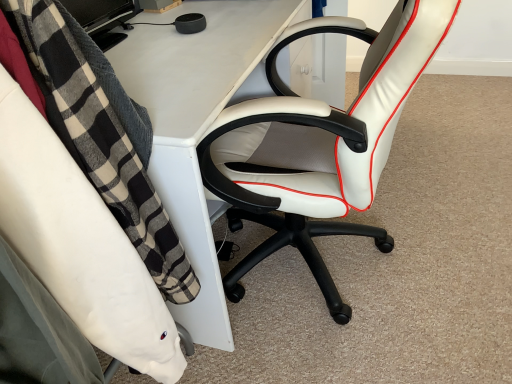
Describe the element at coordinates (79, 244) in the screenshot. The height and width of the screenshot is (384, 512). I see `white leather office chair at right, the first chair positioned from the left` at that location.

You are a GUI agent. You are given a task and a screenshot of the screen. Output one action in this format:
    pyautogui.click(x=<x>, y=<y>)
    Task: Click on the white leather office chair at right, the first chair positioned from the left
    This screenshot has height=384, width=512.
    Given the screenshot: What is the action you would take?
    pyautogui.click(x=79, y=244)

In the scene shown: Does white leather office chair at right, placed as the second chair when sorted from right to left, turn towards white leather office chair at center, which is the second chair in left-to-right order?

No, white leather office chair at right, placed as the second chair when sorted from right to left, is not turned towards white leather office chair at center, which is the second chair in left-to-right order.

Is white leather office chair at right, the first chair positioned from the left, far from white leather office chair at center, which is the 1th chair in right-to-left order?

That's not correct — white leather office chair at right, the first chair positioned from the left, is a little close to white leather office chair at center, which is the 1th chair in right-to-left order.

Considering the positions of objects white leather office chair at right, the first chair positioned from the left, and white leather office chair at center, which is the 1th chair in right-to-left order, in the image provided, who is more to the left, white leather office chair at right, the first chair positioned from the left, or white leather office chair at center, which is the 1th chair in right-to-left order,?

white leather office chair at right, the first chair positioned from the left.

In terms of size, does white leather office chair at right, placed as the second chair when sorted from right to left, appear bigger or smaller than white leather office chair at center, which is the second chair in left-to-right order?

In the image, white leather office chair at right, placed as the second chair when sorted from right to left, appears to be smaller than white leather office chair at center, which is the second chair in left-to-right order.

Which is in front, point (216, 65) or point (127, 306)?

The point (127, 306) is closer.

From the image's perspective, is white plastic desk at center above or below white leather office chair at right, the first chair positioned from the left?

From the image's perspective, white plastic desk at center appears above white leather office chair at right, the first chair positioned from the left.

From a real-world perspective, between white plastic desk at center and white leather office chair at right, the first chair positioned from the left, who is vertically lower?

From a 3D spatial view, white plastic desk at center is below.

Is white plastic desk at center taller or shorter than white leather office chair at right, placed as the second chair when sorted from right to left?

Considering their sizes, white plastic desk at center has more height than white leather office chair at right, placed as the second chair when sorted from right to left.

From a real-world perspective, is white plastic desk at center under white leather office chair at center, which is the second chair in left-to-right order?

Indeed, from a real-world perspective, white plastic desk at center is positioned beneath white leather office chair at center, which is the second chair in left-to-right order.

Does white plastic desk at center have a larger size compared to white leather office chair at center, which is the second chair in left-to-right order?

Indeed, white plastic desk at center has a larger size compared to white leather office chair at center, which is the second chair in left-to-right order.

Identify the location of desk lying on the left of white leather office chair at center, which is the 1th chair in right-to-left order. The width and height of the screenshot is (512, 384). (195, 124).

Considering the points (311, 187) and (121, 65), which point is in front, point (311, 187) or point (121, 65)?

The point (311, 187) is more forward.

At what (x,y) coordinates should I click in order to perform the action: click on the 1st chair directly above the white plastic desk at center (from a real-world perspective). Please return your answer as a coordinate pair (x, y). The height and width of the screenshot is (384, 512). Looking at the image, I should click on (319, 144).

Considering the relative positions of white leather office chair at center, which is the second chair in left-to-right order, and white plastic desk at center in the image provided, is white leather office chair at center, which is the second chair in left-to-right order, to the left of white plastic desk at center from the viewer's perspective?

Incorrect, white leather office chair at center, which is the second chair in left-to-right order, is not on the left side of white plastic desk at center.

Is white leather office chair at right, placed as the second chair when sorted from right to left, turned away from white plastic desk at center?

white leather office chair at right, placed as the second chair when sorted from right to left, is not turned away from white plastic desk at center.

Considering the relative sizes of white leather office chair at right, placed as the second chair when sorted from right to left, and white plastic desk at center in the image provided, is white leather office chair at right, placed as the second chair when sorted from right to left, thinner than white plastic desk at center?

Yes, white leather office chair at right, placed as the second chair when sorted from right to left, is thinner than white plastic desk at center.

Is white leather office chair at right, the first chair positioned from the left, in front of white plastic desk at center?

Yes, it is.

Is white leather office chair at right, placed as the second chair when sorted from right to left, not close to white plastic desk at center?

white leather office chair at right, placed as the second chair when sorted from right to left, is near white plastic desk at center, not far away.

Considering the relative sizes of white leather office chair at center, which is the 1th chair in right-to-left order, and white leather office chair at right, the first chair positioned from the left, in the image provided, is white leather office chair at center, which is the 1th chair in right-to-left order, wider than white leather office chair at right, the first chair positioned from the left,?

Yes.

Is white leather office chair at center, which is the second chair in left-to-right order, not inside white leather office chair at right, the first chair positioned from the left?

white leather office chair at center, which is the second chair in left-to-right order, lies outside white leather office chair at right, the first chair positioned from the left,'s area.

Between point (224, 172) and point (92, 321), which one is positioned in front?

The point (92, 321) is closer to the camera.

From a real-world perspective, is white leather office chair at center, which is the 1th chair in right-to-left order, located beneath white leather office chair at right, the first chair positioned from the left?

Yes, from a real-world perspective, white leather office chair at center, which is the 1th chair in right-to-left order, is beneath white leather office chair at right, the first chair positioned from the left.

Locate an element on the screen. The image size is (512, 384). chair in front of the white leather office chair at center, which is the 1th chair in right-to-left order is located at coordinates (79, 244).

Where is `the 2nd chair located above the white plastic desk at center (from a real-world perspective)`? Image resolution: width=512 pixels, height=384 pixels. the 2nd chair located above the white plastic desk at center (from a real-world perspective) is located at coordinates (79, 244).

Considering their positions, is white leather office chair at right, placed as the second chair when sorted from right to left, positioned further to white leather office chair at center, which is the second chair in left-to-right order, than white plastic desk at center?

The object further to white leather office chair at center, which is the second chair in left-to-right order, is white leather office chair at right, placed as the second chair when sorted from right to left.

When comparing their distances from white plastic desk at center, does white leather office chair at center, which is the 1th chair in right-to-left order, or white leather office chair at right, the first chair positioned from the left, seem further?

Among the two, white leather office chair at right, the first chair positioned from the left, is located further to white plastic desk at center.

When comparing their distances from white leather office chair at right, the first chair positioned from the left, does white leather office chair at center, which is the 1th chair in right-to-left order, or white plastic desk at center seem further?

Based on the image, white leather office chair at center, which is the 1th chair in right-to-left order, appears to be further to white leather office chair at right, the first chair positioned from the left.

Based on the photo, considering their positions, is white plastic desk at center positioned further to white leather office chair at right, the first chair positioned from the left, than white leather office chair at center, which is the second chair in left-to-right order?

white leather office chair at center, which is the second chair in left-to-right order, is further to white leather office chair at right, the first chair positioned from the left.

Estimate the real-world distances between objects in this image. Which object is closer to white leather office chair at center, which is the second chair in left-to-right order, white plastic desk at center or white leather office chair at right, placed as the second chair when sorted from right to left?

Based on the image, white plastic desk at center appears to be nearer to white leather office chair at center, which is the second chair in left-to-right order.

From the image, which object appears to be nearer to white plastic desk at center, white leather office chair at right, the first chair positioned from the left, or white leather office chair at center, which is the 1th chair in right-to-left order?

white leather office chair at center, which is the 1th chair in right-to-left order, lies closer to white plastic desk at center than the other object.

Locate an element on the screen. desk situated between white leather office chair at right, placed as the second chair when sorted from right to left, and white leather office chair at center, which is the second chair in left-to-right order, from left to right is located at coordinates (195, 124).